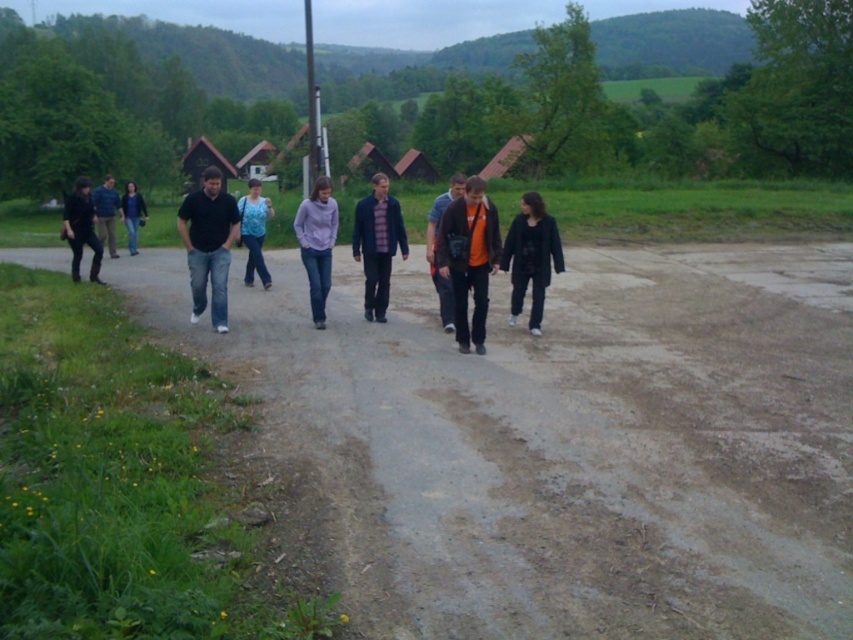
Can you confirm if dark gray jeans at left is positioned to the left of matte black shirt at center?

Indeed, dark gray jeans at left is positioned on the left side of matte black shirt at center.

Locate an element on the screen. The height and width of the screenshot is (640, 853). dark gray jeans at left is located at coordinates (80, 228).

Who is positioned more to the right, plaid fabric shirt at center or purple matte shirt at center?

plaid fabric shirt at center

Is the position of plaid fabric shirt at center less distant than that of purple matte shirt at center?

No.

Which is behind, point (364, 208) or point (297, 216)?

The point (364, 208) is more distant.

In order to click on plaid fabric shirt at center in this screenshot , I will do `click(376, 243)`.

Which is below, black matte jacket at center or matte black shirt at center?

black matte jacket at center

Identify the location of black matte jacket at center. The image size is (853, 640). (531, 257).

This screenshot has height=640, width=853. What are the coordinates of `black matte jacket at center` in the screenshot? It's located at (531, 257).